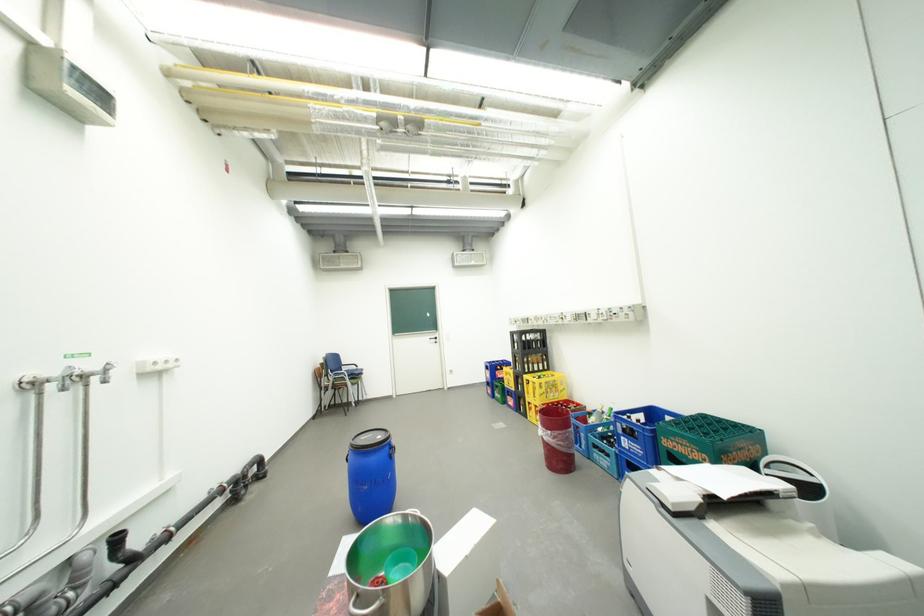
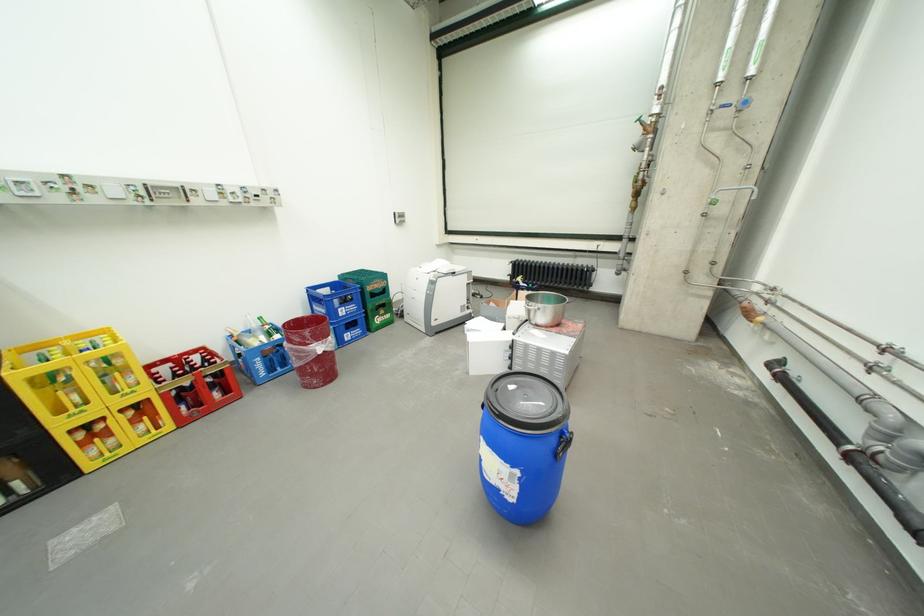
The point at [570,411] is marked in the first image. Where is the corresponding point in the second image?

(297, 328)